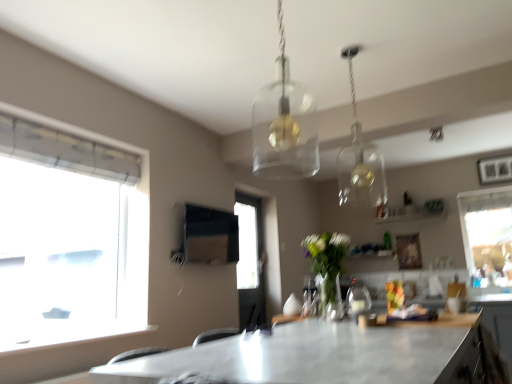
Question: Is point (505, 316) closer or farther from the camera than point (313, 269)?

Choices:
 (A) closer
 (B) farther

Answer: (A)

Question: From the image's perspective, is matte black cabinet at lower right positioned above or below clear glass vase at center?

Choices:
 (A) above
 (B) below

Answer: (B)

Question: Estimate the real-world distances between objects in this image. Which object is farther from the clear glass vase at center?

Choices:
 (A) transparent glass window at right
 (B) clear glass pendant light at upper center, which appears as the 1th lamp when viewed from the right
 (C) transparent glass pendant light at center, which ranks as the 2th lamp in back-to-front order
 (D) matte black cabinet at lower right
 (E) metallic gray table at center

Answer: (A)

Question: Which object is positioned closest to the transparent glass window at right?

Choices:
 (A) clear glass pendant light at upper center, positioned as the 1th lamp in back-to-front order
 (B) clear glass vase at center
 (C) matte black cabinet at lower right
 (D) metallic gray table at center
 (E) transparent glass pendant light at center, the second lamp in the right-to-left sequence

Answer: (C)